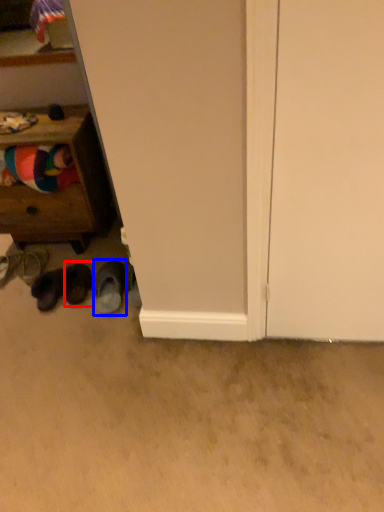
Question: Which of the following is the closest to the observer, footwear (highlighted by a red box) or footwear (highlighted by a blue box)?

Choices:
 (A) footwear
 (B) footwear

Answer: (B)